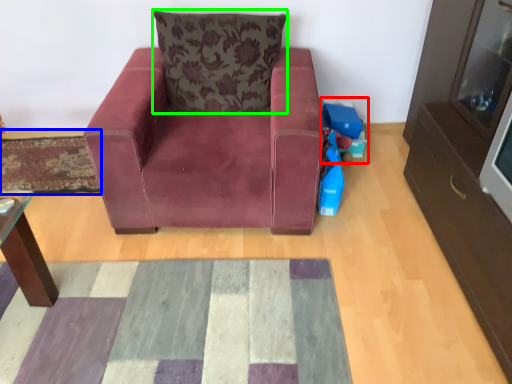
Question: Based on their relative distances, which object is nearer to toy (highlighted by a red box)? Choose from mat (highlighted by a blue box) and pillow (highlighted by a green box).

Choices:
 (A) mat
 (B) pillow

Answer: (B)